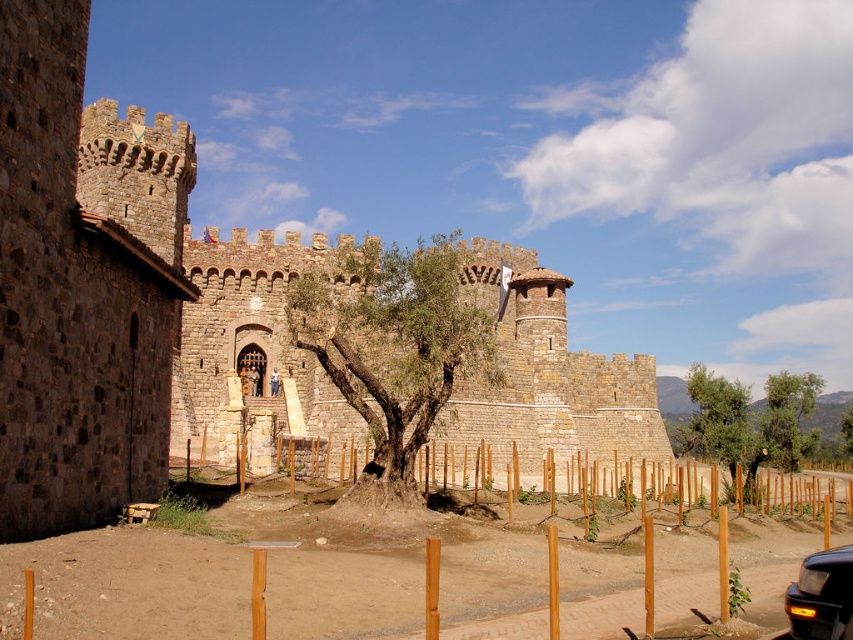
You are a visitor arriving at the medieval castle and notice the green leafy tree at upper right and the metallic gray car at lower right. Which object is located to the right of the other?

The green leafy tree at upper right is positioned on the right side of metallic gray car at lower right.